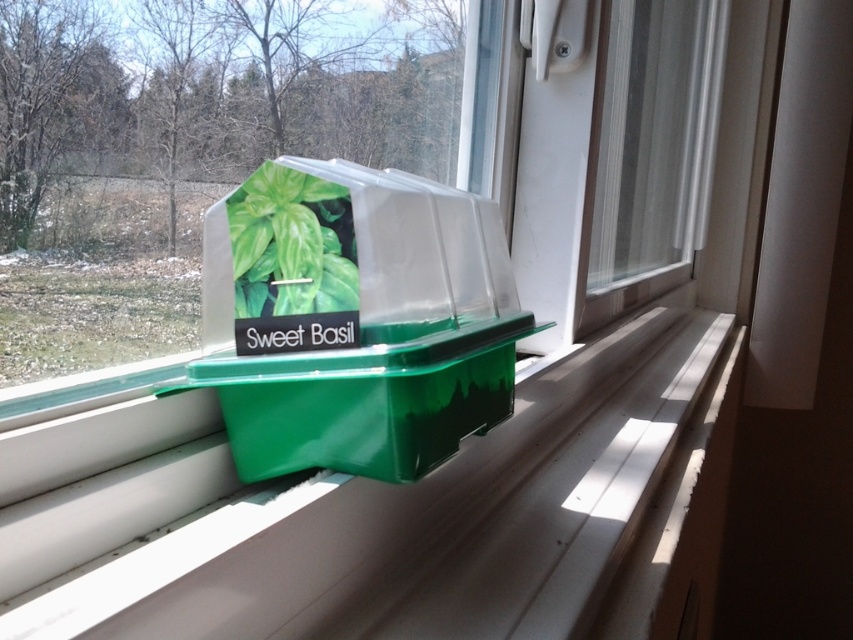
What do you see at coordinates (357, 320) in the screenshot? The height and width of the screenshot is (640, 853). I see `green plastic box at center` at bounding box center [357, 320].

Which of these two, green plastic box at center or green matte plastic sweet basil at center, stands taller?

With more height is green plastic box at center.

Which is in front, point (227, 412) or point (345, 280)?

Point (345, 280) is more forward.

The image size is (853, 640). In order to click on green plastic box at center in this screenshot , I will do `click(357, 320)`.

Can you confirm if green plastic container at center is positioned below green matte plastic sweet basil at center?

Yes, green plastic container at center is below green matte plastic sweet basil at center.

Looking at this image, measure the distance from green plastic container at center to green matte plastic sweet basil at center.

green plastic container at center and green matte plastic sweet basil at center are 13.26 inches apart.

Which is behind, point (566, 428) or point (270, 262)?

Positioned behind is point (566, 428).

Where is `green plastic container at center`? The height and width of the screenshot is (640, 853). green plastic container at center is located at coordinates (375, 520).

Who is taller, green plastic container at center or green plastic box at center?

Standing taller between the two is green plastic box at center.

Does green plastic container at center have a greater height compared to green plastic box at center?

Incorrect, green plastic container at center's height is not larger of green plastic box at center's.

Who is more forward, [131,545] or [370,307]?

Point [131,545] is more forward.

Find the location of a particular element. green plastic container at center is located at coordinates (375, 520).